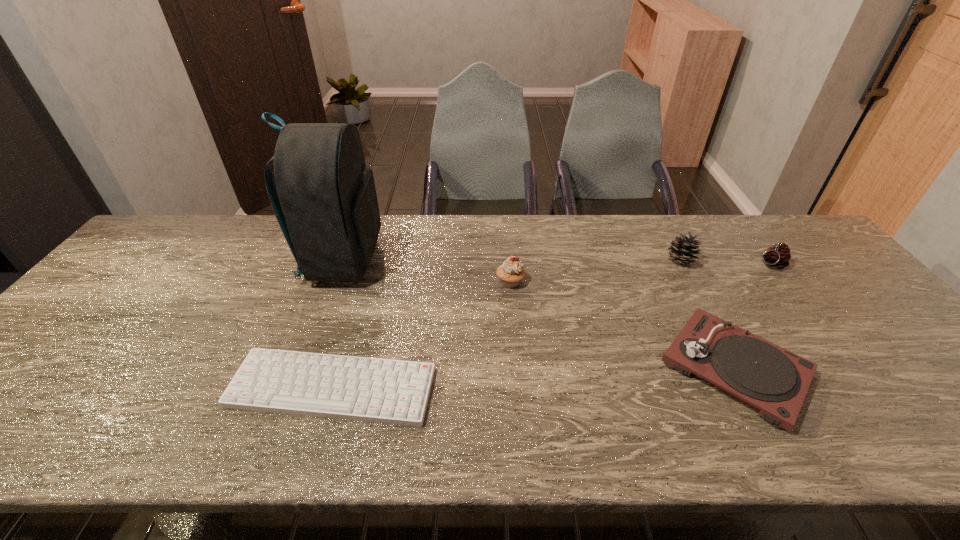
Find the location of a particular element. This screenshot has height=540, width=960. vacant space positioned with a leaf charm attached to the shorter pinecone is located at coordinates point(641,264).

The image size is (960, 540). I want to click on vacant position located with a leaf charm attached to the shorter pinecone, so click(725, 264).

Image resolution: width=960 pixels, height=540 pixels. In order to click on vacant region located with a leaf charm attached to the shorter pinecone in this screenshot , I will do tap(738, 264).

At what (x,y) coordinates should I click in order to perform the action: click on vacant area situated on the right of the phonograph_record. Please return your answer as a coordinate pair (x, y). Image resolution: width=960 pixels, height=540 pixels. Looking at the image, I should click on (920, 368).

This screenshot has height=540, width=960. What are the coordinates of `vacant area situated on the back of the shortest object` in the screenshot? It's located at (372, 252).

You are a GUI agent. You are given a task and a screenshot of the screen. Output one action in this format:
    pyautogui.click(x=<x>, y=<y>)
    Task: Click on the backpack present at the far edge
    This screenshot has width=960, height=540.
    Given the screenshot: What is the action you would take?
    pyautogui.click(x=326, y=204)

The width and height of the screenshot is (960, 540). I want to click on phonograph_record located at the near edge, so (765, 376).

You are a GUI agent. You are given a task and a screenshot of the screen. Output one action in this format:
    pyautogui.click(x=<x>, y=<y>)
    Task: Click on the computer keyboard present at the near edge
    The width and height of the screenshot is (960, 540).
    Given the screenshot: What is the action you would take?
    pyautogui.click(x=386, y=391)

I want to click on object at the right edge, so click(778, 256).

Find the location of `object located at the far right corner`. object located at the far right corner is located at coordinates (778, 256).